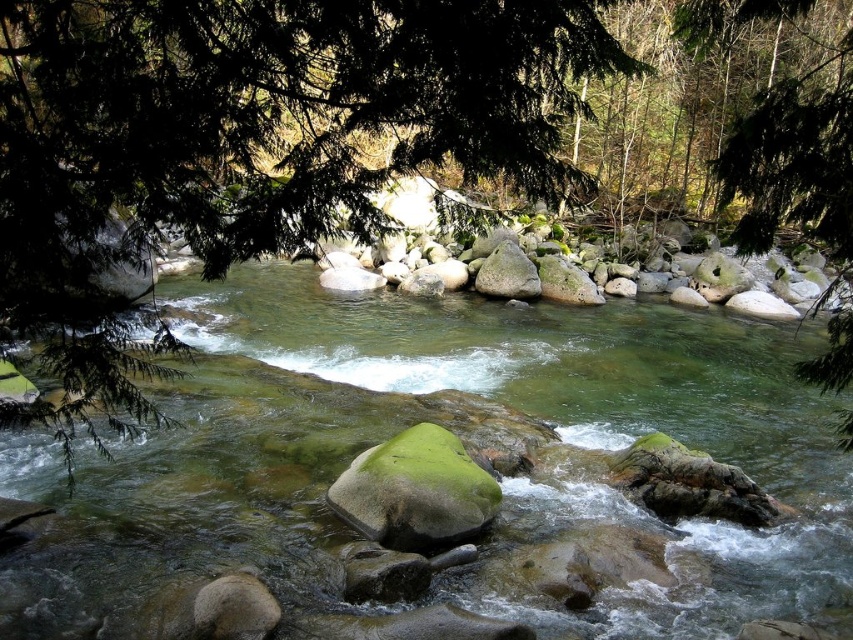
Is translucent green water at center to the right of green mossy rock at center from the viewer's perspective?

No, translucent green water at center is not to the right of green mossy rock at center.

Describe the element at coordinates (459, 436) in the screenshot. I see `translucent green water at center` at that location.

Describe the element at coordinates (459, 436) in the screenshot. This screenshot has width=853, height=640. I see `translucent green water at center` at that location.

The height and width of the screenshot is (640, 853). What are the coordinates of `translucent green water at center` in the screenshot? It's located at (459, 436).

Who is more distant from viewer, (821, 573) or (404, 163)?

The point (821, 573) is behind.

Who is lower down, translucent green water at center or green leafy tree at upper left?

translucent green water at center is lower down.

Locate an element on the screen. The image size is (853, 640). translucent green water at center is located at coordinates (459, 436).

Based on the photo, between green mossy rock at center and smooth gray rock at center, which one appears on the right side from the viewer's perspective?

From the viewer's perspective, smooth gray rock at center appears more on the right side.

Is green mossy rock at center below smooth gray rock at center?

Indeed, green mossy rock at center is positioned under smooth gray rock at center.

Does point (418, 467) come in front of point (531, 269)?

Yes, point (418, 467) is closer to viewer.

This screenshot has height=640, width=853. What are the coordinates of `green mossy rock at center` in the screenshot? It's located at (415, 490).